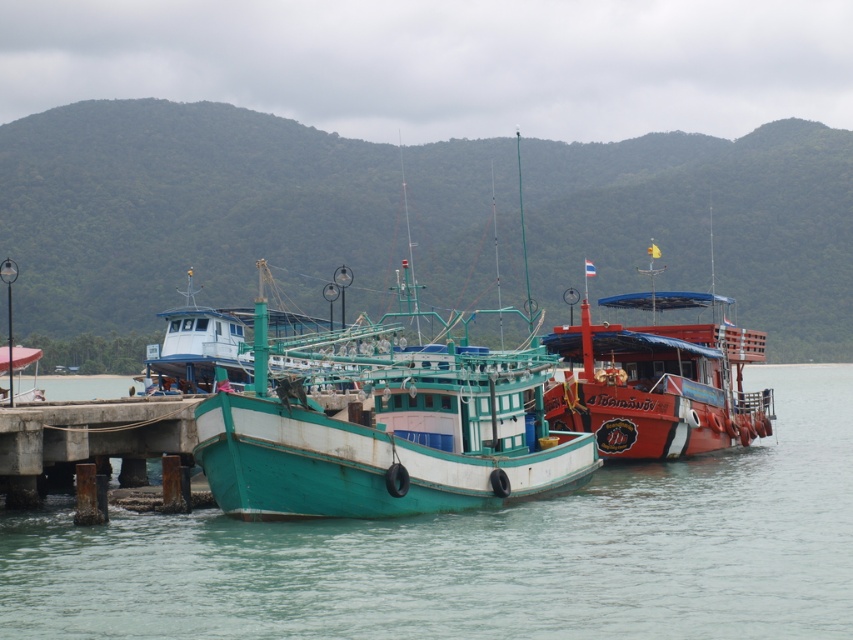
Question: Which object is closer to the camera taking this photo?

Choices:
 (A) concrete pier at lower left
 (B) shiny red boat at right
 (C) teal wooden boat at center
 (D) green matte water at center

Answer: (D)

Question: Based on their relative distances, which object is farther from the teal wooden boat at center?

Choices:
 (A) shiny red boat at right
 (B) concrete pier at lower left

Answer: (A)

Question: Is shiny red boat at right further to the viewer compared to concrete pier at lower left?

Choices:
 (A) no
 (B) yes

Answer: (B)

Question: Is green matte water at center to the left of concrete pier at lower left from the viewer's perspective?

Choices:
 (A) yes
 (B) no

Answer: (B)

Question: Which of the following is the closest to the observer?

Choices:
 (A) (57, 429)
 (B) (653, 388)
 (C) (289, 468)
 (D) (323, 595)

Answer: (D)

Question: From the image, what is the correct spatial relationship of green matte water at center in relation to concrete pier at lower left?

Choices:
 (A) below
 (B) above

Answer: (A)